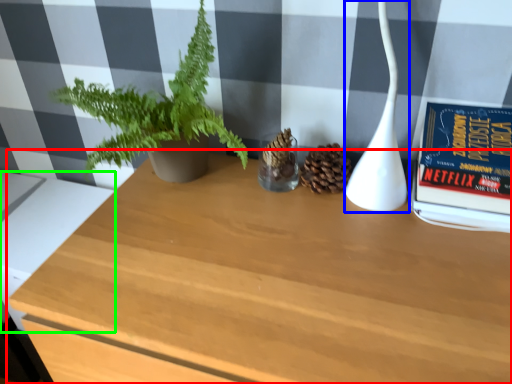
Question: Which is nearer to the table (highlighted by a red box)? lamp (highlighted by a blue box) or table (highlighted by a green box).

Choices:
 (A) lamp
 (B) table

Answer: (A)